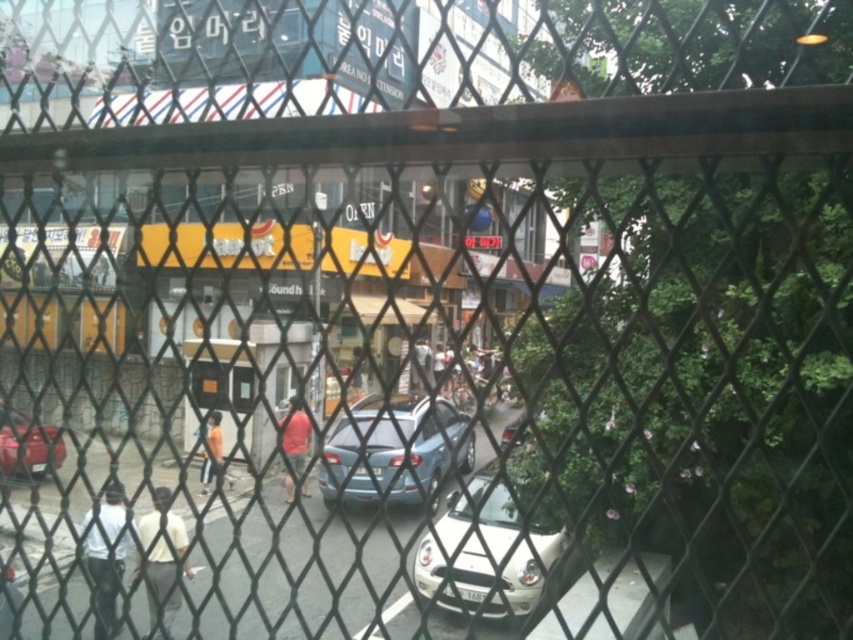
Does matte red car at lower left have a greater width compared to matte red shirt at center?

Correct, the width of matte red car at lower left exceeds that of matte red shirt at center.

What do you see at coordinates (27, 444) in the screenshot? The height and width of the screenshot is (640, 853). I see `matte red car at lower left` at bounding box center [27, 444].

Find the location of a particular element. This screenshot has width=853, height=640. matte red car at lower left is located at coordinates (27, 444).

Is white matte car at center bigger than orange fabric pants at center?

Actually, white matte car at center might be smaller than orange fabric pants at center.

Does white matte car at center appear under orange fabric pants at center?

Incorrect, white matte car at center is not positioned below orange fabric pants at center.

Is point (529, 592) in front of point (207, 436)?

Yes.

Locate an element on the screen. The image size is (853, 640). white matte car at center is located at coordinates (489, 556).

Between matte blue sedan at center and matte red shirt at center, which one has more height?

Standing taller between the two is matte blue sedan at center.

Does matte blue sedan at center come behind matte red shirt at center?

No.

You are a GUI agent. You are given a task and a screenshot of the screen. Output one action in this format:
    pyautogui.click(x=<x>, y=<y>)
    Task: Click on the matte blue sedan at center
    This screenshot has width=853, height=640.
    Given the screenshot: What is the action you would take?
    pyautogui.click(x=389, y=449)

Image resolution: width=853 pixels, height=640 pixels. Identify the location of matte blue sedan at center. (389, 449).